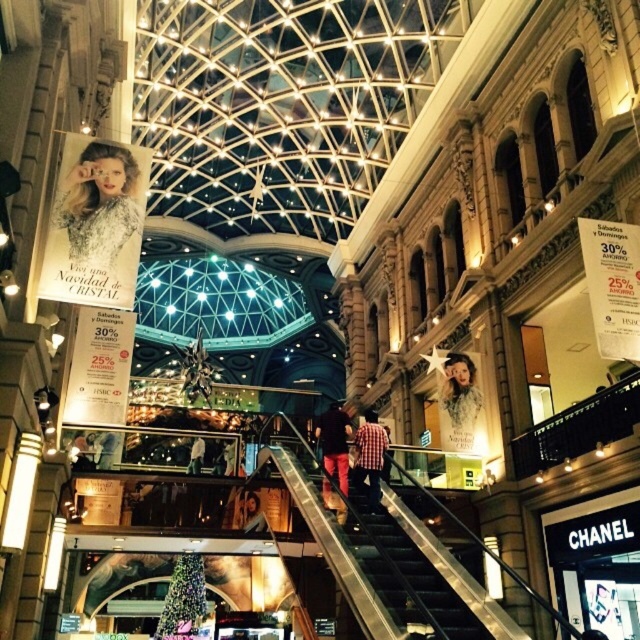
Question: Does metallic silver stairs at center appear under matte white blouse at center?

Choices:
 (A) no
 (B) yes

Answer: (B)

Question: Which point is closer to the camera taking this photo?

Choices:
 (A) (200, 568)
 (B) (456, 426)
 (C) (432, 588)

Answer: (C)

Question: Does metallic silver stairs at center have a greater width compared to red plaid shirt at center?

Choices:
 (A) no
 (B) yes

Answer: (B)

Question: Estimate the real-world distances between objects in this image. Which object is closer to the metallic escalator at center?

Choices:
 (A) matte white blouse at center
 (B) red plaid shirt at center
 (C) matte silver poster at upper left
 (D) checkered fabric shirt at center

Answer: (D)

Question: Can you confirm if metallic escalator at center is positioned to the right of matte white blouse at center?

Choices:
 (A) yes
 (B) no

Answer: (B)

Question: Considering the real-world distances, which object is farthest from the red plaid shirt at center?

Choices:
 (A) metallic silver stairs at center
 (B) matte silver poster at upper left
 (C) checkered fabric shirt at center
 (D) metallic escalator at center

Answer: (B)